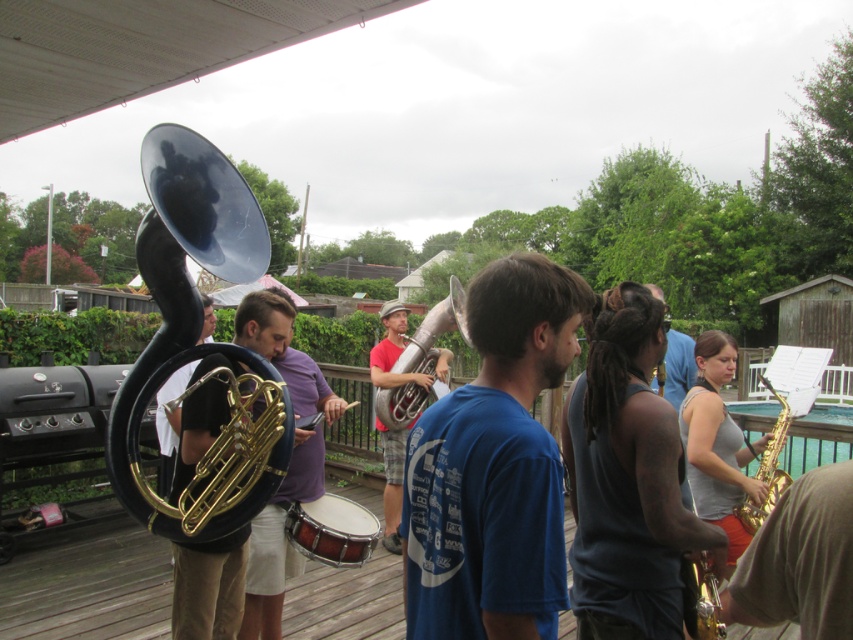
Question: Can you confirm if gold brass trumpet at left is thinner than wooden snare drum at center?

Choices:
 (A) no
 (B) yes

Answer: (A)

Question: Where is gold shiny trumpet at center-right located in relation to blue shirt at center in the image?

Choices:
 (A) right
 (B) left

Answer: (A)

Question: Which is nearer to the gold brass trumpet at left?

Choices:
 (A) wooden snare drum at center
 (B) shiny brass trumpet at center

Answer: (A)

Question: Based on their relative distances, which object is farther from the matte gold tuba at center?

Choices:
 (A) gold shiny trumpet at center-right
 (B) blue shirt at center

Answer: (A)

Question: Which point is closer to the camera?

Choices:
 (A) red matte tuba at center
 (B) gold brass trumpet at left
 (C) gray tank top at center

Answer: (C)

Question: Is blue cotton t-shirt at center behind wooden snare drum at center?

Choices:
 (A) yes
 (B) no

Answer: (B)